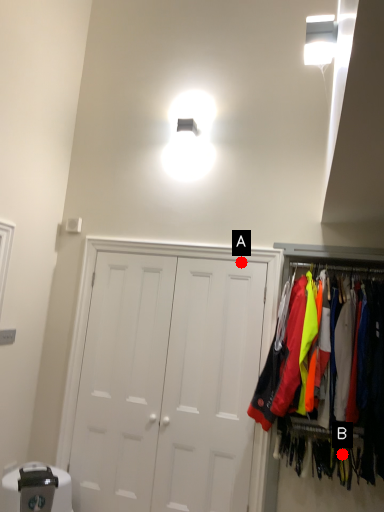
Question: Two points are circled on the image, labeled by A and B beside each circle. Which point appears farthest from the camera in this image?

Choices:
 (A) A is further
 (B) B is further

Answer: (A)